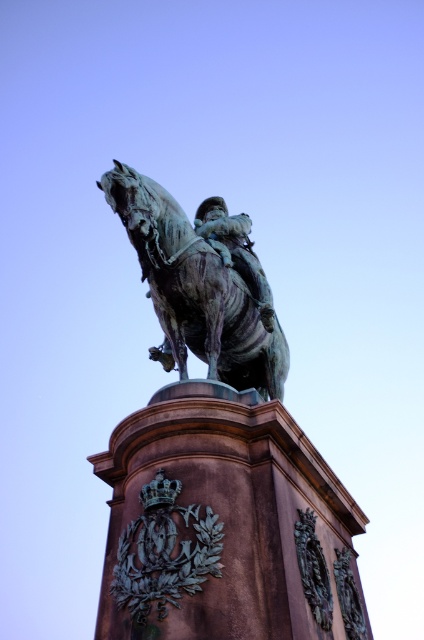
You are standing in front of the equestrian statue and want to take a photo. You notice two points marked on the pedestal. The first point is at coordinates point (268, 387) and the second is at point (158, 512). Which point is closer to your camera lens when taking the photo?

Point (158, 512) is closer to the camera lens because it is less further away than point (268, 387).